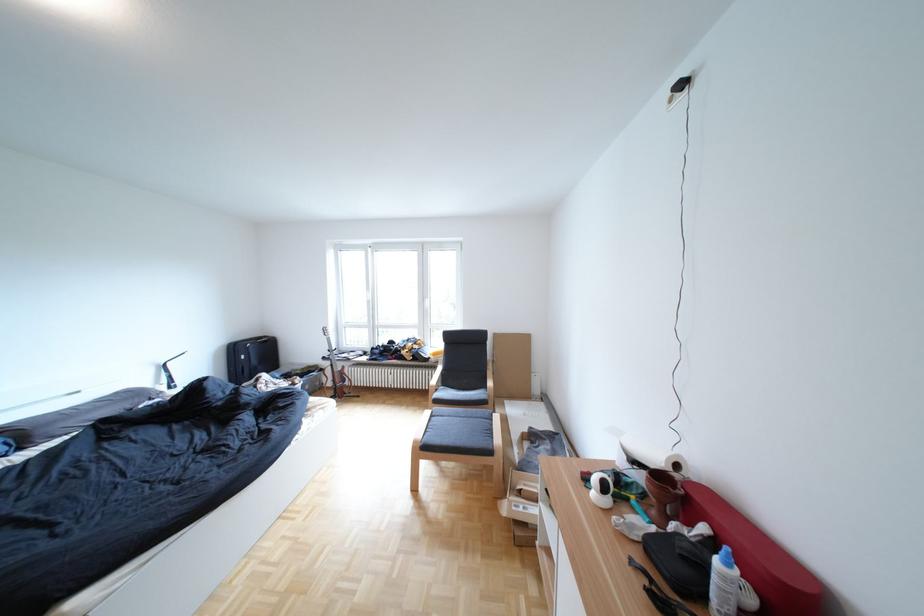
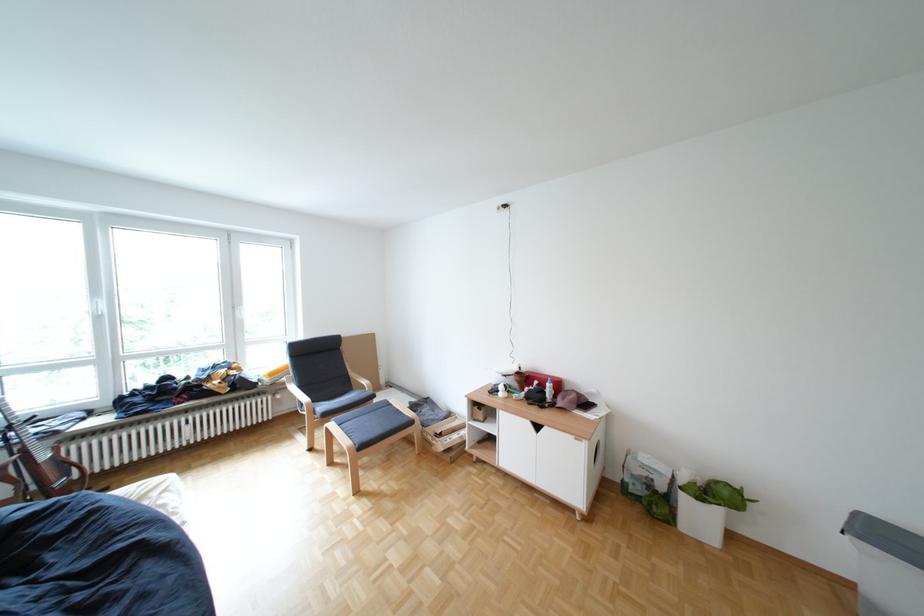
Find the pixel in the second image that matches the point at 719,529 in the first image.

(552, 383)